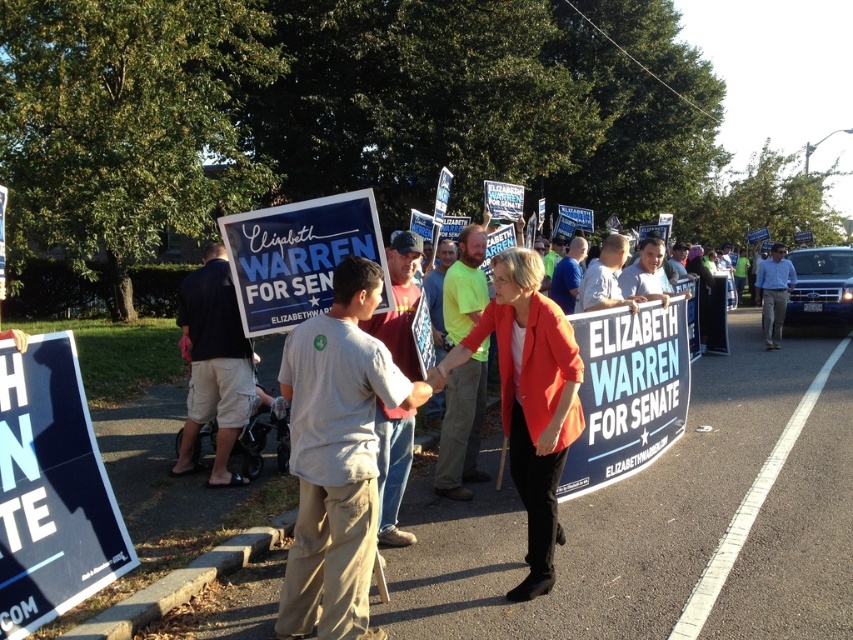
Question: In this image, where is gray cotton t-shirt at center located relative to matte red blazer at center?

Choices:
 (A) below
 (B) above

Answer: (A)

Question: Does dark blue fabric sign at center have a larger size compared to light blue shirt at center?

Choices:
 (A) yes
 (B) no

Answer: (A)

Question: Which object appears farthest from the camera in this image?

Choices:
 (A) gray cotton t-shirt at center
 (B) matte red blazer at center

Answer: (B)

Question: Can you confirm if gray cotton t-shirt at center is wider than dark blue fabric sign at center?

Choices:
 (A) no
 (B) yes

Answer: (A)

Question: Which of the following is the farthest from the observer?

Choices:
 (A) (778, 301)
 (B) (351, 352)

Answer: (A)

Question: Estimate the real-world distances between objects in this image. Which object is farther from the matte red blazer at center?

Choices:
 (A) light blue shirt at center
 (B) gray cotton t-shirt at center
 (C) dark blue fabric sign at center

Answer: (A)